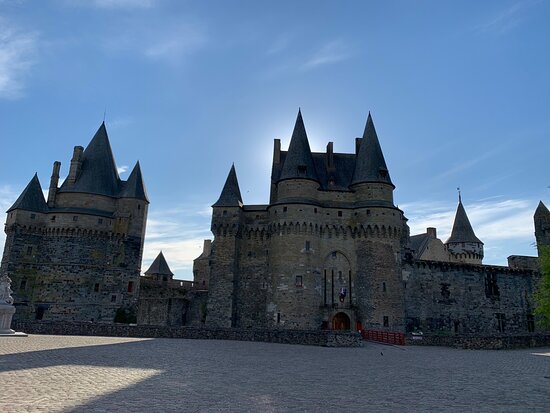
The image size is (550, 413). Identify the location of crosses/crucifixes. (104, 115), (459, 189).